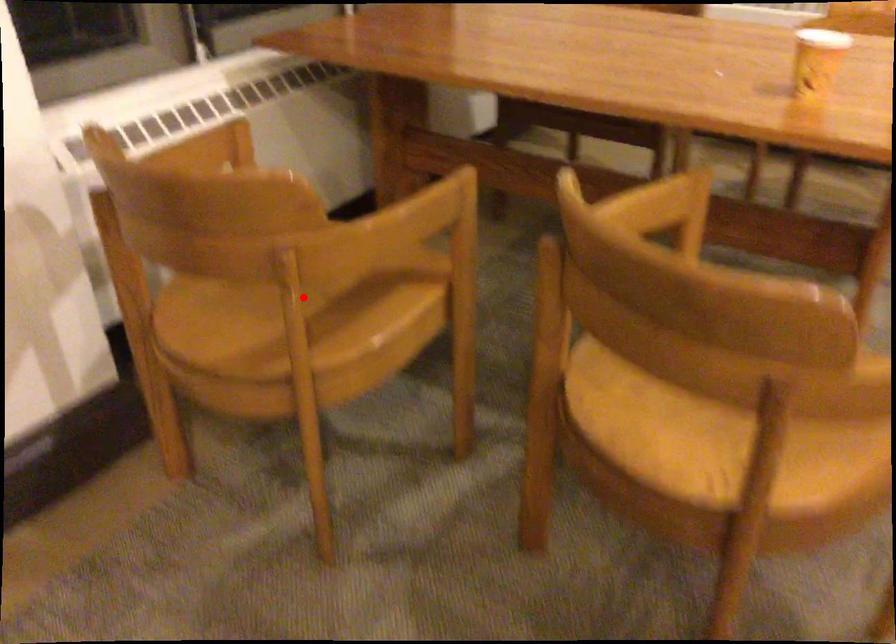
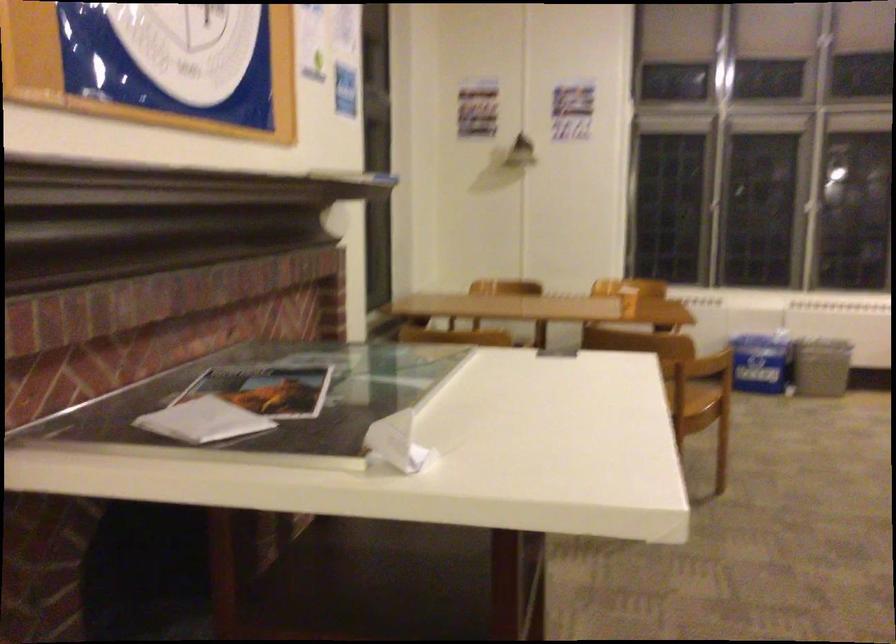
Question: I am providing you with two images of the same scene from different viewpoints. A red point is marked on the first image. Is the red point's position out of view in image 2?

Choices:
 (A) Yes
 (B) No

Answer: (A)